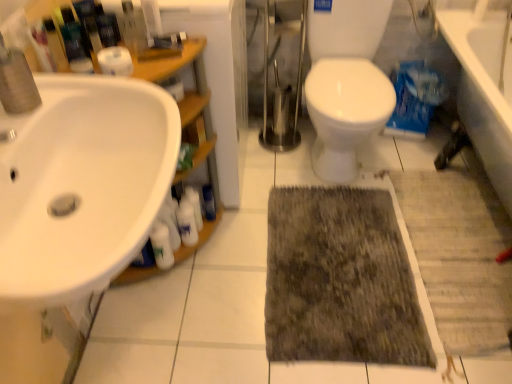
Where is `free region under dark gray shaggy rug at center (from a real-world perspective)`? free region under dark gray shaggy rug at center (from a real-world perspective) is located at coordinates (343, 264).